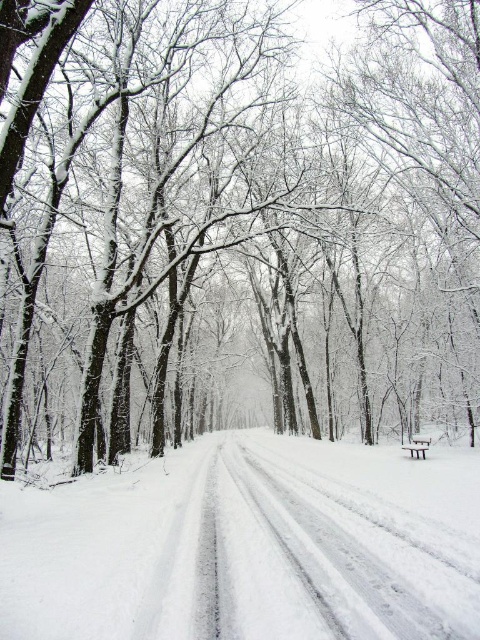
What do you see at coordinates (248, 545) in the screenshot? I see `white powdery snow at center` at bounding box center [248, 545].

Is point (200, 632) closer to viewer compared to point (407, 448)?

That is True.

The height and width of the screenshot is (640, 480). In order to click on white powdery snow at center in this screenshot , I will do `click(248, 545)`.